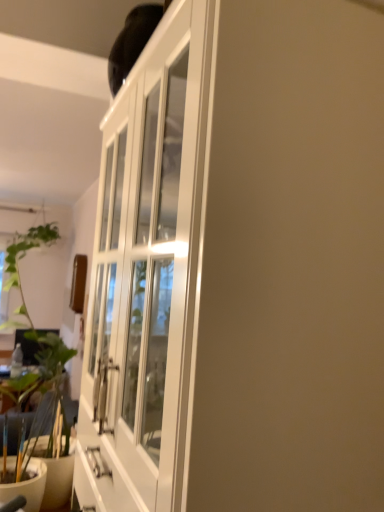
At what (x,y) coordinates should I click in order to perform the action: click on green leafy plant at left. Please return your answer as a coordinate pair (x, y). Image resolution: width=384 pixels, height=512 pixels. Looking at the image, I should click on (31, 320).

Describe the element at coordinates (31, 320) in the screenshot. Image resolution: width=384 pixels, height=512 pixels. I see `green leafy plant at left` at that location.

Locate an element on the screen. The image size is (384, 512). green leafy plant at left is located at coordinates (31, 320).